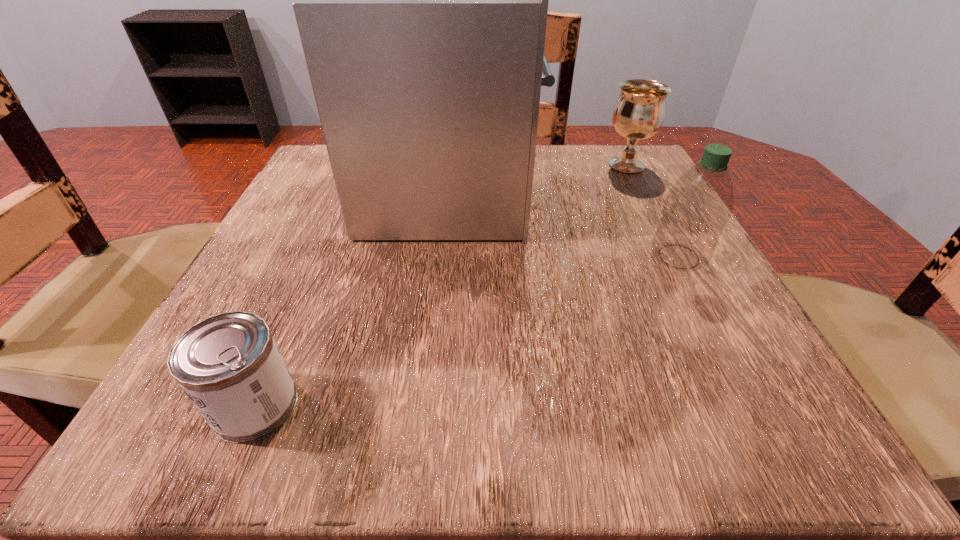
Identify the location of chalice at the far edge. (638, 114).

Where is `object positioned at the near edge`? object positioned at the near edge is located at coordinates (229, 365).

You are a GUI agent. You are given a task and a screenshot of the screen. Output one action in this format:
    pyautogui.click(x=<x>, y=<y>)
    Task: Click on the toaster oven that is at the left edge
    
    Given the screenshot: What is the action you would take?
    pyautogui.click(x=421, y=2)

This screenshot has height=540, width=960. In order to click on can that is at the left edge in this screenshot , I will do `click(229, 365)`.

The height and width of the screenshot is (540, 960). I want to click on water bottle present at the right edge, so click(x=697, y=207).

Locate an element on the screen. This screenshot has width=960, height=540. chalice that is at the right edge is located at coordinates (638, 114).

Where is `object located at the far left corner`? The height and width of the screenshot is (540, 960). object located at the far left corner is located at coordinates (421, 2).

In order to click on object that is at the near left corner in this screenshot , I will do `click(229, 365)`.

At what (x,y) coordinates should I click in order to perform the action: click on object positioned at the far right corner. Please return your answer as a coordinate pair (x, y). The image size is (960, 540). Looking at the image, I should click on (638, 114).

You are a GUI agent. You are given a task and a screenshot of the screen. Output one action in this format:
    pyautogui.click(x=<x>, y=<y>)
    Task: Click on the vacant position at the far edge of the desktop
    This screenshot has width=960, height=540.
    Given the screenshot: What is the action you would take?
    pyautogui.click(x=548, y=159)